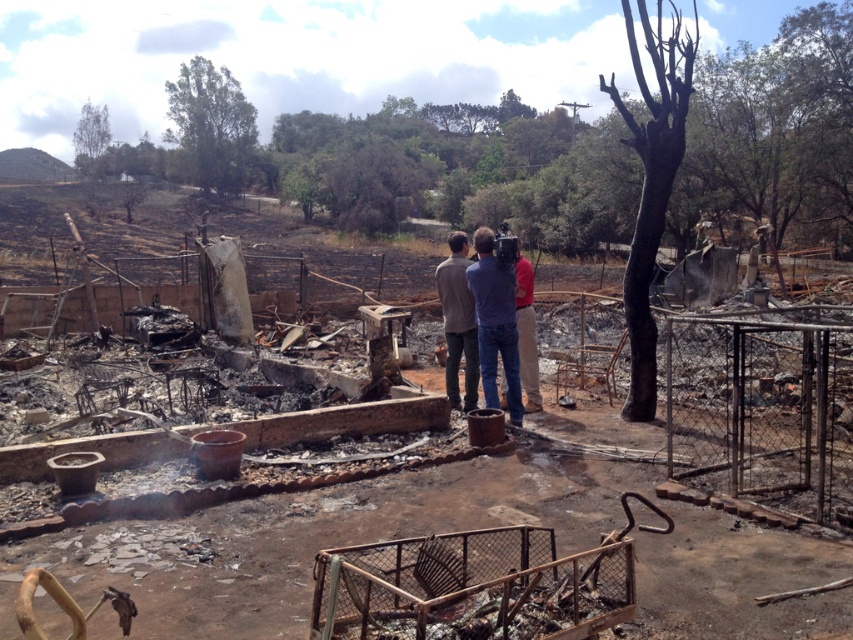
Question: Among these points, which one is nearest to the camera?

Choices:
 (A) (3, 636)
 (B) (473, 268)

Answer: (A)

Question: Does charcoal ash debris at center have a lesser width compared to matte gray jacket at center?

Choices:
 (A) yes
 (B) no

Answer: (B)

Question: Does matte gray jacket at center appear on the left side of gray fabric jacket at center?

Choices:
 (A) no
 (B) yes

Answer: (A)

Question: Which object is closer to the camera taking this photo?

Choices:
 (A) gray fabric jacket at center
 (B) charcoal ash debris at center

Answer: (B)

Question: Among these objects, which one is nearest to the camera?

Choices:
 (A) matte gray jacket at center
 (B) gray fabric jacket at center

Answer: (A)

Question: Does charcoal ash debris at center appear under gray fabric jacket at center?

Choices:
 (A) no
 (B) yes

Answer: (B)